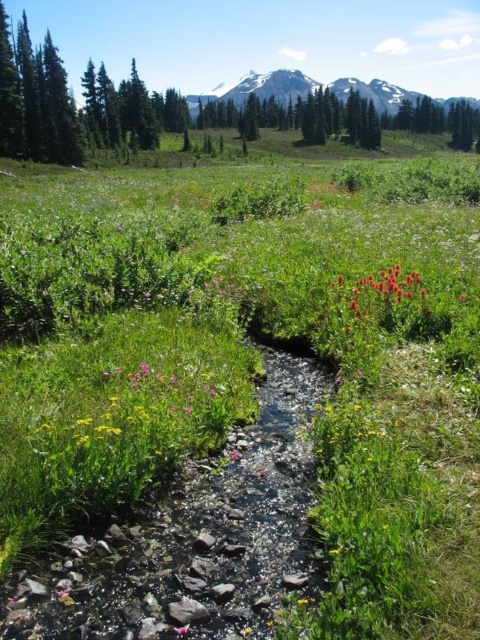
Does point (243, 88) come closer to viewer compared to point (404, 300)?

No.

In the scene shown: Does snowy granite mountain at upper center have a smaller size compared to vivid crimson petals at center?

No.

Is point (375, 99) closer to camera compared to point (383, 289)?

No, (375, 99) is behind (383, 289).

You are a GUI agent. You are given a task and a screenshot of the screen. Output one action in this format:
    pyautogui.click(x=<x>, y=<y>)
    Task: Click on the snowy granite mountain at upper center
    This screenshot has width=480, height=640.
    Given the screenshot: What is the action you would take?
    pyautogui.click(x=259, y=88)

How much distance is there between snowy granite mountain at upper center and pink matte flower at center?

The distance of snowy granite mountain at upper center from pink matte flower at center is 451.76 meters.

Does snowy granite mountain at upper center appear under pink matte flower at center?

Actually, snowy granite mountain at upper center is above pink matte flower at center.

Is point (288, 77) positioned before point (188, 625)?

No, it is behind (188, 625).

The image size is (480, 640). I want to click on snowy granite mountain at upper center, so click(259, 88).

Is vivid crimson petals at center to the right of pink matte flower at center from the viewer's perspective?

Correct, you'll find vivid crimson petals at center to the right of pink matte flower at center.

Who is positioned more to the left, vivid crimson petals at center or pink matte flower at center?

pink matte flower at center

Where is `vivid crimson petals at center`? The height and width of the screenshot is (640, 480). vivid crimson petals at center is located at coordinates point(383,291).

Locate an element on the screen. This screenshot has height=640, width=480. vivid crimson petals at center is located at coordinates (383, 291).